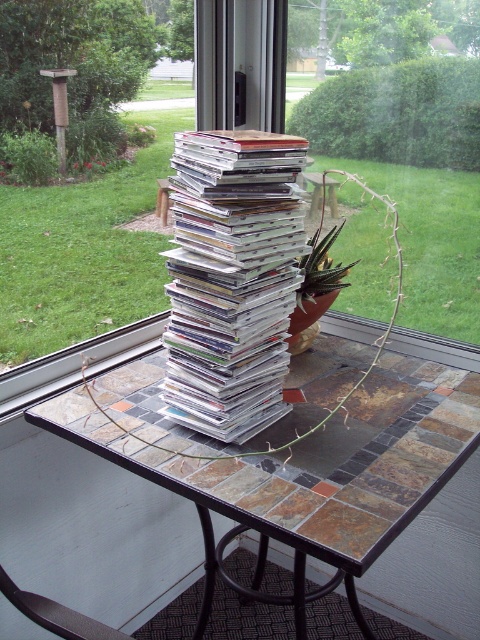
Does point (474, 307) lie behind point (404, 161)?

Yes, it is.

Does green succulent at center lie behind green leafy plant at center?

Yes, green succulent at center is behind green leafy plant at center.

Find the location of a particular element. The height and width of the screenshot is (640, 480). green succulent at center is located at coordinates (431, 243).

Does clear plastic magazines at center have a larger size compared to green leafy plant at center?

No.

You are a GUI agent. You are given a task and a screenshot of the screen. Output one action in this format:
    pyautogui.click(x=<x>, y=<y>)
    Task: Click on the clear plastic magazines at center
    The height and width of the screenshot is (640, 480).
    Given the screenshot: What is the action you would take?
    pyautogui.click(x=231, y=278)

Locate an element on the screen. Image resolution: width=480 pixels, height=640 pixels. clear plastic magazines at center is located at coordinates (231, 278).

Does point (376, 525) come in front of point (468, 246)?

Yes, it is.

Which is below, tile mosaic table at center or green succulent at center?

tile mosaic table at center is lower down.

The image size is (480, 640). Describe the element at coordinates (319, 461) in the screenshot. I see `tile mosaic table at center` at that location.

Locate an element on the screen. The image size is (480, 640). tile mosaic table at center is located at coordinates (319, 461).